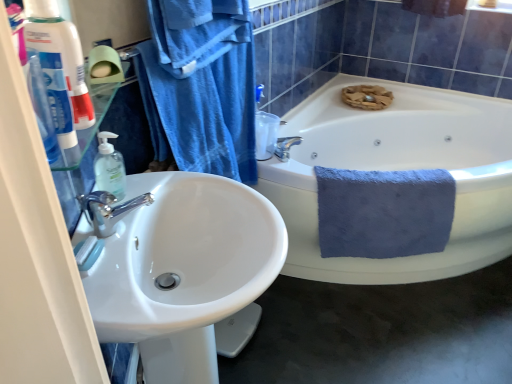
Question: Is white glossy toothpaste tube at left not inside blue fluffy towel at right, marked as the 2th bath towel in a front-to-back arrangement?

Choices:
 (A) yes
 (B) no

Answer: (A)

Question: From a real-world perspective, is white glossy toothpaste tube at left physically below blue fluffy towel at right, placed as the 2th bath towel when sorted from left to right?

Choices:
 (A) yes
 (B) no

Answer: (B)

Question: From the image's perspective, is white glossy toothpaste tube at left under blue fluffy towel at right, placed as the 1th bath towel when sorted from back to front?

Choices:
 (A) yes
 (B) no

Answer: (B)

Question: Is white glossy toothpaste tube at left at the right side of blue fluffy towel at right, placed as the 1th bath towel when sorted from back to front?

Choices:
 (A) no
 (B) yes

Answer: (A)

Question: Is white glossy toothpaste tube at left oriented away from blue fluffy towel at right, placed as the 2th bath towel when sorted from left to right?

Choices:
 (A) yes
 (B) no

Answer: (B)

Question: Is blue cotton towel at upper left, the 2th bath towel viewed from the back, wider or thinner than white glossy sink at left?

Choices:
 (A) wide
 (B) thin

Answer: (B)

Question: From a real-world perspective, is blue cotton towel at upper left, the 2th bath towel viewed from the back, physically located above or below white glossy sink at left?

Choices:
 (A) below
 (B) above

Answer: (B)

Question: From the image's perspective, is blue cotton towel at upper left, the 1th bath towel in the front-to-back sequence, above or below white glossy sink at left?

Choices:
 (A) below
 (B) above

Answer: (B)

Question: In terms of height, does blue cotton towel at upper left, the 1th bath towel in the front-to-back sequence, look taller or shorter compared to white glossy sink at left?

Choices:
 (A) tall
 (B) short

Answer: (B)

Question: Would you say white glossy toothpaste tube at left is inside or outside white ceramic bathtub at center?

Choices:
 (A) inside
 (B) outside

Answer: (B)

Question: Is white glossy toothpaste tube at left wider or thinner than white ceramic bathtub at center?

Choices:
 (A) thin
 (B) wide

Answer: (A)

Question: Visually, is white glossy toothpaste tube at left positioned to the left or to the right of white ceramic bathtub at center?

Choices:
 (A) right
 (B) left

Answer: (B)

Question: Based on their sizes in the image, would you say white glossy toothpaste tube at left is bigger or smaller than white ceramic bathtub at center?

Choices:
 (A) small
 (B) big

Answer: (A)

Question: Does point (52, 14) appear closer or farther from the camera than point (84, 223)?

Choices:
 (A) farther
 (B) closer

Answer: (B)

Question: Is white glossy toothpaste tube at left wider or thinner than white glossy sink at left?

Choices:
 (A) thin
 (B) wide

Answer: (A)